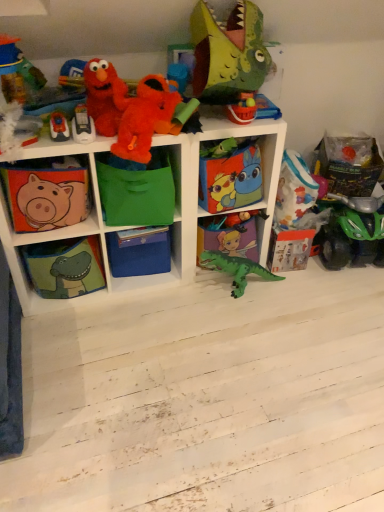
The image size is (384, 512). In order to click on free spot to the right of green fabric storage cubes at center, which is counted as the 3th shelf, starting from the right in this screenshot , I will do `click(295, 320)`.